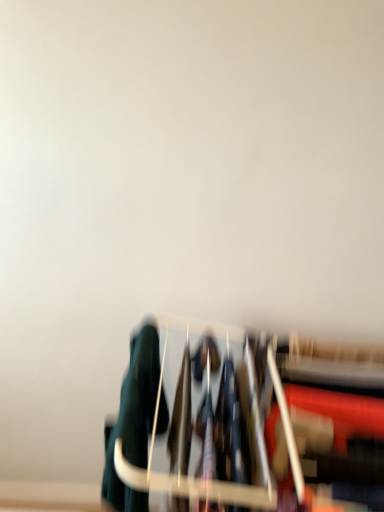
Find the location of a particular element. This screenshot has width=384, height=512. metallic silver rack at center is located at coordinates (241, 421).

What is the approximate width of metallic silver rack at center?

metallic silver rack at center is 26.68 inches in width.

The image size is (384, 512). What do you see at coordinates (241, 421) in the screenshot?
I see `metallic silver rack at center` at bounding box center [241, 421].

What do you see at coordinates (133, 420) in the screenshot? I see `dark green fabric at lower left` at bounding box center [133, 420].

Measure the distance between dark green fabric at lower left and camera.

dark green fabric at lower left and camera are 30.77 inches apart.

Locate an element on the screen. dark green fabric at lower left is located at coordinates (x=133, y=420).

Find the location of a particular element. metallic silver rack at center is located at coordinates (241, 421).

Can you confirm if metallic silver rack at center is positioned to the right of dark green fabric at lower left?

Yes.

In the image, is metallic silver rack at center positioned in front of or behind dark green fabric at lower left?

metallic silver rack at center is in front of dark green fabric at lower left.

Considering the positions of point (196, 492) and point (138, 494), is point (196, 492) closer or farther from the camera than point (138, 494)?

Clearly, point (196, 492) is closer to the camera than point (138, 494).

From the image's perspective, which one is positioned lower, metallic silver rack at center or dark green fabric at lower left?

metallic silver rack at center is shown below in the image.

From a real-world perspective, between metallic silver rack at center and dark green fabric at lower left, who is vertically higher?

In real-world perspective, dark green fabric at lower left is above.

Consider the image. Which object is thinner, metallic silver rack at center or dark green fabric at lower left?

dark green fabric at lower left is thinner.

Which of these two, metallic silver rack at center or dark green fabric at lower left, stands taller?

metallic silver rack at center.

Which of these two, metallic silver rack at center or dark green fabric at lower left, is bigger?

With larger size is metallic silver rack at center.

Choose the correct answer: Is metallic silver rack at center inside dark green fabric at lower left or outside it?

metallic silver rack at center is spatially situated outside dark green fabric at lower left.

Is metallic silver rack at center beside dark green fabric at lower left?

metallic silver rack at center is not next to dark green fabric at lower left, and they're not touching.

Is metallic silver rack at center facing towards dark green fabric at lower left?

No, metallic silver rack at center is not aimed at dark green fabric at lower left.

Can you tell me how much metallic silver rack at center and dark green fabric at lower left differ in facing direction?

They differ by 1.02e-05 degrees in their facing directions.

Image resolution: width=384 pixels, height=512 pixels. There is a metallic silver rack at center. What are the coordinates of `clothing above it (from a real-world perspective)` in the screenshot? It's located at (133, 420).

Can you confirm if dark green fabric at lower left is positioned to the right of metallic silver rack at center?

No, dark green fabric at lower left is not to the right of metallic silver rack at center.

Which object is further away from the camera taking this photo, dark green fabric at lower left or metallic silver rack at center?

dark green fabric at lower left.

Which point is more distant from viewer, (128,377) or (129,414)?

The point (128,377) is behind.

From the image's perspective, which one is positioned lower, dark green fabric at lower left or metallic silver rack at center?

metallic silver rack at center.

From the picture: From a real-world perspective, is dark green fabric at lower left physically above metallic silver rack at center?

Correct, in the physical world, dark green fabric at lower left is higher than metallic silver rack at center.

Is dark green fabric at lower left wider or thinner than metallic silver rack at center?

In the image, dark green fabric at lower left appears to be more narrow than metallic silver rack at center.

Can you confirm if dark green fabric at lower left is shorter than metallic silver rack at center?

Yes.

Can you confirm if dark green fabric at lower left is bigger than metallic silver rack at center?

No, dark green fabric at lower left is not bigger than metallic silver rack at center.

Consider the image. Choose the correct answer: Is dark green fabric at lower left inside metallic silver rack at center or outside it?

dark green fabric at lower left is located inside metallic silver rack at center.

Would you say dark green fabric at lower left is a long distance from metallic silver rack at center?

No, dark green fabric at lower left is not far away from metallic silver rack at center.

Is dark green fabric at lower left positioned with its back to metallic silver rack at center?

Yes, metallic silver rack at center is at the back of dark green fabric at lower left.

This screenshot has height=512, width=384. I want to click on clothing on the left of metallic silver rack at center, so click(x=133, y=420).

Where is `clothing above the metallic silver rack at center (from the image's perspective)`? This screenshot has height=512, width=384. clothing above the metallic silver rack at center (from the image's perspective) is located at coordinates (133, 420).

The height and width of the screenshot is (512, 384). I want to click on furniture that is on the right side of dark green fabric at lower left, so click(241, 421).